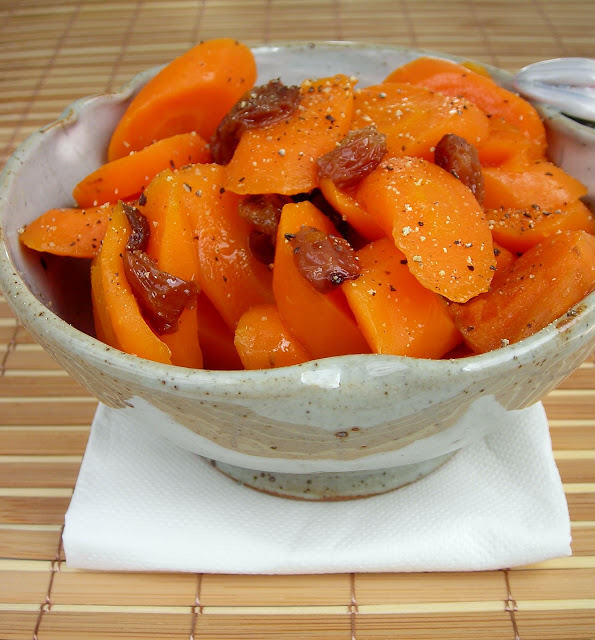
This screenshot has height=640, width=595. Identify the location of napkin. (303, 536).